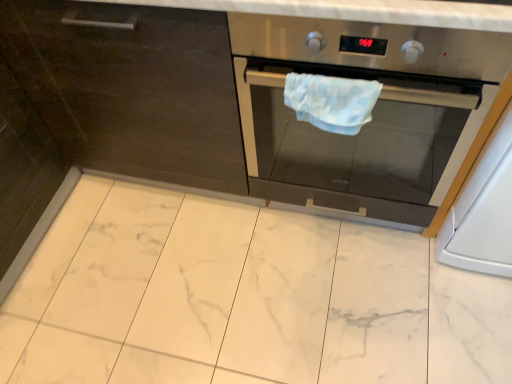
Question: From a real-world perspective, is white glossy oven at right under stainless steel oven at center?

Choices:
 (A) no
 (B) yes

Answer: (B)

Question: Is stainless steel oven at center at the back of white glossy oven at right?

Choices:
 (A) no
 (B) yes

Answer: (A)

Question: Does white glossy oven at right have a greater width compared to stainless steel oven at center?

Choices:
 (A) no
 (B) yes

Answer: (B)

Question: Can you confirm if white glossy oven at right is smaller than stainless steel oven at center?

Choices:
 (A) no
 (B) yes

Answer: (A)

Question: Does white glossy oven at right contain stainless steel oven at center?

Choices:
 (A) no
 (B) yes

Answer: (A)

Question: From a real-world perspective, is stainless steel oven at center physically located above or below light blue fabric hand towel at center?

Choices:
 (A) above
 (B) below

Answer: (B)

Question: Is stainless steel oven at center wider or thinner than light blue fabric hand towel at center?

Choices:
 (A) thin
 (B) wide

Answer: (B)

Question: In terms of size, does stainless steel oven at center appear bigger or smaller than light blue fabric hand towel at center?

Choices:
 (A) big
 (B) small

Answer: (A)

Question: In terms of height, does stainless steel oven at center look taller or shorter compared to light blue fabric hand towel at center?

Choices:
 (A) short
 (B) tall

Answer: (B)

Question: Considering the positions of light blue fabric hand towel at center and white glossy oven at right in the image, is light blue fabric hand towel at center wider or thinner than white glossy oven at right?

Choices:
 (A) wide
 (B) thin

Answer: (B)

Question: From the image's perspective, is light blue fabric hand towel at center located above or below white glossy oven at right?

Choices:
 (A) below
 (B) above

Answer: (B)

Question: Considering the positions of light blue fabric hand towel at center and white glossy oven at right in the image, is light blue fabric hand towel at center taller or shorter than white glossy oven at right?

Choices:
 (A) tall
 (B) short

Answer: (B)

Question: Which is correct: light blue fabric hand towel at center is inside white glossy oven at right, or outside of it?

Choices:
 (A) inside
 (B) outside

Answer: (B)

Question: In the image, is white glossy oven at right positioned in front of or behind light blue fabric hand towel at center?

Choices:
 (A) front
 (B) behind

Answer: (A)

Question: Which is correct: white glossy oven at right is inside light blue fabric hand towel at center, or outside of it?

Choices:
 (A) inside
 (B) outside

Answer: (B)